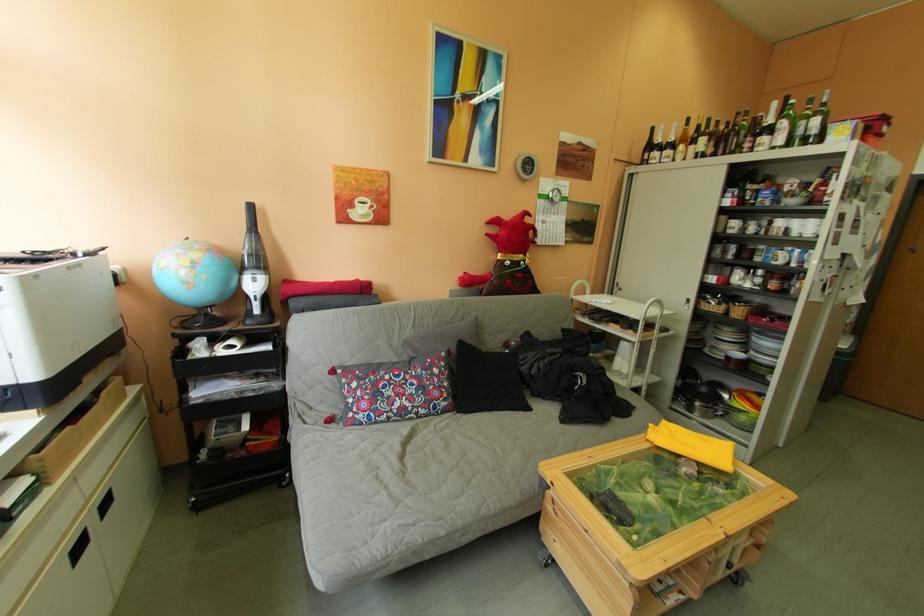
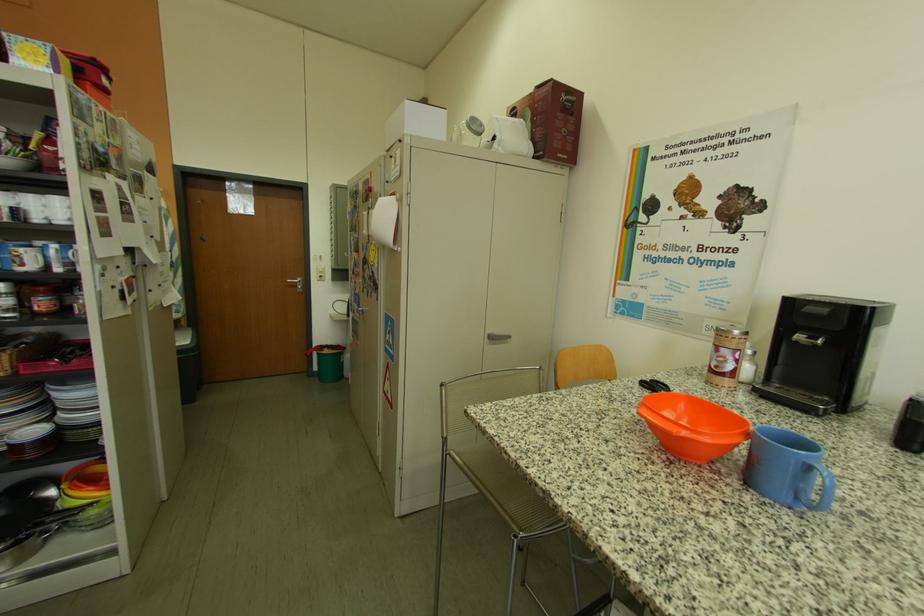
Question: The camera is either moving clockwise (left) or counter-clockwise (right) around the object. The first image is from the beginning of the video and the second image is from the end. Is the camera moving left or right when shooting the video?

Choices:
 (A) Left
 (B) Right

Answer: (A)